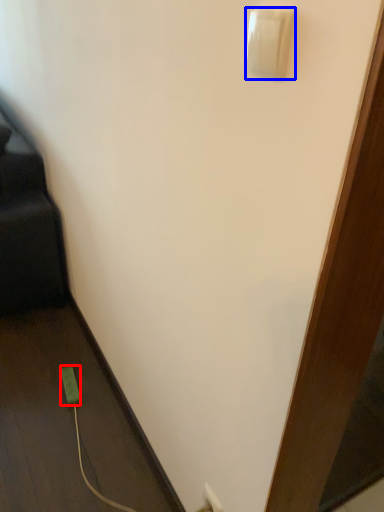
Question: Among these objects, which one is nearest to the camera, power plugs and sockets (highlighted by a red box) or light switch (highlighted by a blue box)?

Choices:
 (A) power plugs and sockets
 (B) light switch

Answer: (B)